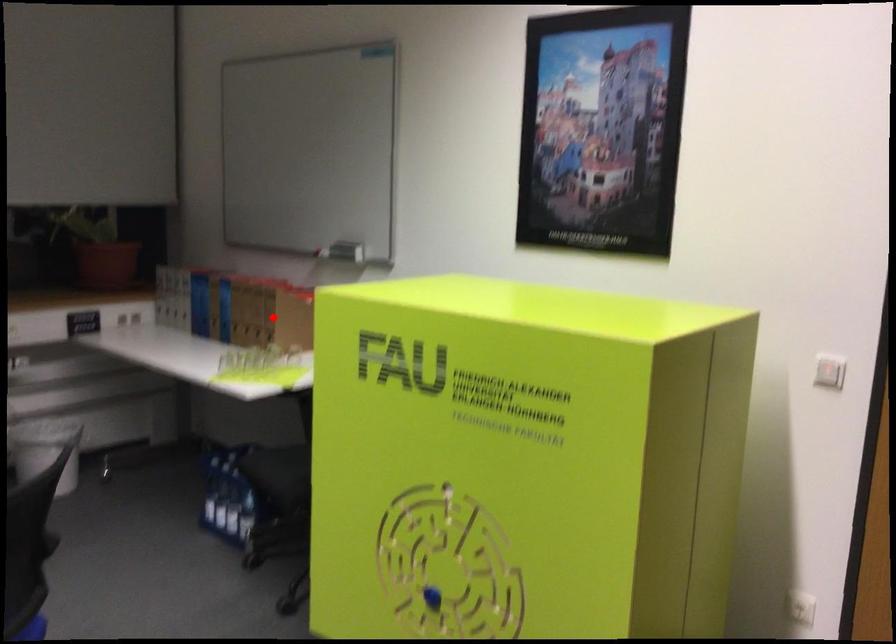
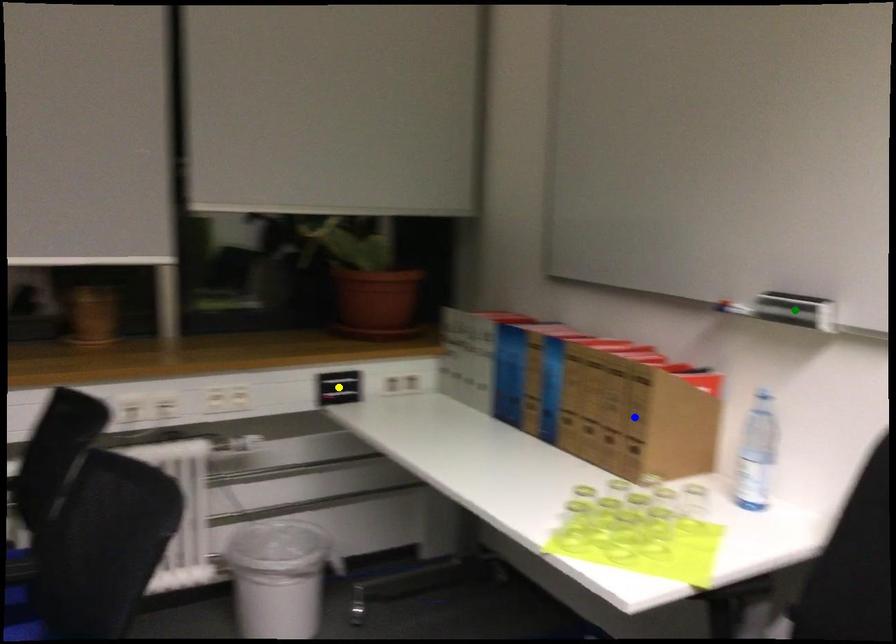
Question: I am providing you with two images of the same scene from different viewpoints. A red point is marked on the first image. You are given multiple points on the second image. Which point in image 2 is actually the same real-world point as the red point in image 1?

Choices:
 (A) blue point
 (B) green point
 (C) yellow point

Answer: (A)